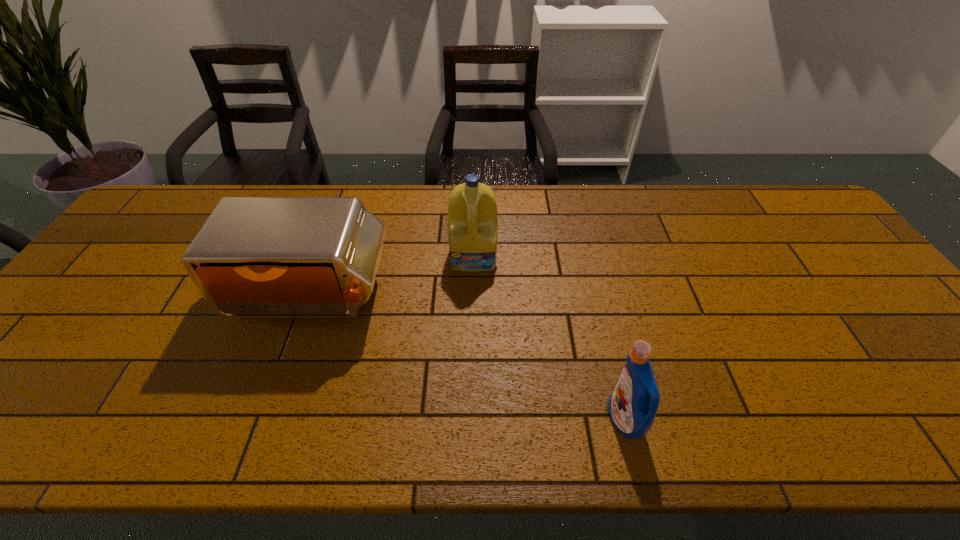
You are a GUI agent. You are given a task and a screenshot of the screen. Output one action in this format:
    pyautogui.click(x=<x>, y=<y>)
    Task: Click on the taller detergent
    This screenshot has width=960, height=540.
    Given the screenshot: What is the action you would take?
    [x=472, y=211]

The image size is (960, 540). I want to click on the left detergent, so pos(472,211).

The width and height of the screenshot is (960, 540). What are the coordinates of `toaster oven` in the screenshot? It's located at (255, 257).

At what (x,y) coordinates should I click in order to perform the action: click on the rightmost object. Please return your answer as a coordinate pair (x, y). The image size is (960, 540). Looking at the image, I should click on (632, 406).

Identify the location of the shorter detergent. (632, 406).

Where is `free space located 0.190m on the label of the taller detergent`? Image resolution: width=960 pixels, height=540 pixels. free space located 0.190m on the label of the taller detergent is located at coordinates (473, 327).

Where is `free space located 0.120m on the door side of the toaster oven`? This screenshot has height=540, width=960. free space located 0.120m on the door side of the toaster oven is located at coordinates (281, 377).

In order to click on vacant space located on the label of the nearer detergent in this screenshot , I will do `click(477, 420)`.

I want to click on vacant space located 0.260m on the label of the nearer detergent, so click(x=487, y=420).

This screenshot has height=540, width=960. What are the coordinates of `free space located 0.050m on the label of the nearer detergent` in the screenshot? It's located at (586, 420).